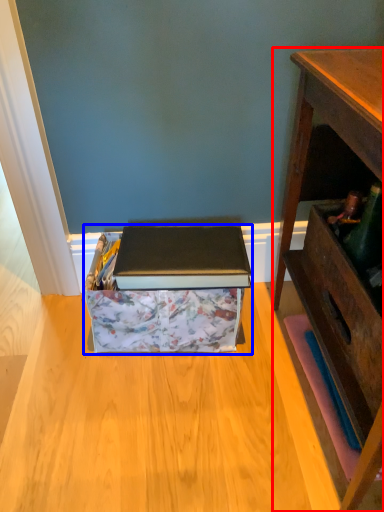
Question: Among these objects, which one is farthest to the camera, desk (highlighted by a red box) or cardboard box (highlighted by a blue box)?

Choices:
 (A) desk
 (B) cardboard box

Answer: (B)